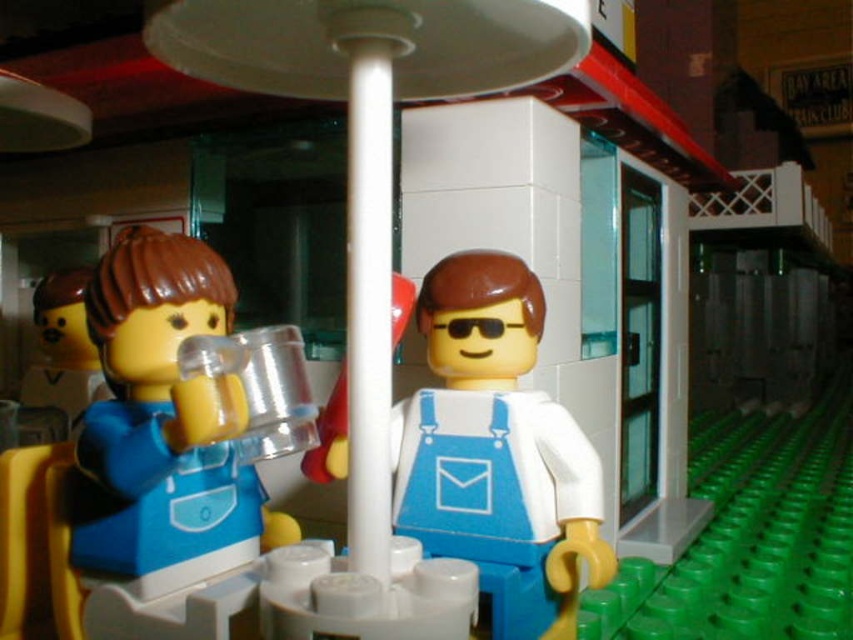
You are a customer in the LEGO diner scene. You want to place your order with the server. Which object, the white matte overalls at center or the matte plastic cup at left, is closer to the table?

The white matte overalls at center is below the matte plastic cup at left, meaning it is closer to the table.

You are designing a display case for a LEGO exhibit and need to ensure the white matte overalls at center and the translucent plastic cup at left fit together. Which object should you place first to ensure they fit properly?

The white matte overalls at center is smaller than the translucent plastic cup at left, so you should place the translucent plastic cup at left first to ensure proper alignment and space for the smaller overalls.

You are a customer in the LEGO diner scene. You see the white matte overalls at center and the translucent plastic cup at left. Which object is closer to you?

The white matte overalls at center is positioned under the translucent plastic cup at left, so the cup is closer to you.